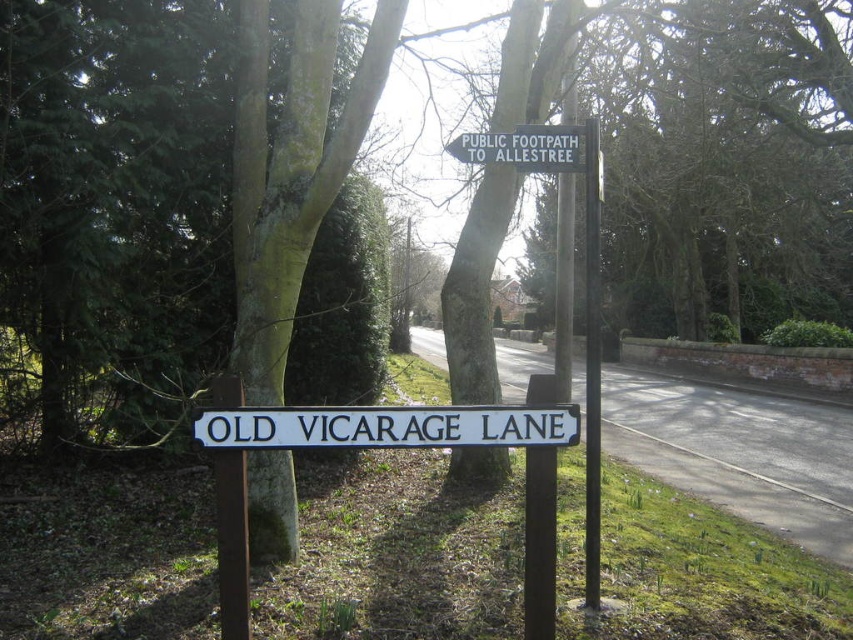
Does green rough bark tree at center come behind white wooden sign at center?

Yes, it is behind white wooden sign at center.

Can you confirm if green rough bark tree at center is thinner than white wooden sign at center?

No.

Does point (262, 163) come farther from viewer compared to point (498, 412)?

Yes, point (262, 163) is farther from viewer.

Where is `green rough bark tree at center`? green rough bark tree at center is located at coordinates (184, 211).

Is white wooden sign at center to the left of white plastic sign at upper center from the viewer's perspective?

Correct, you'll find white wooden sign at center to the left of white plastic sign at upper center.

Which is in front, point (479, 419) or point (485, 145)?

Point (479, 419)

Describe the element at coordinates (387, 426) in the screenshot. This screenshot has width=853, height=640. I see `white wooden sign at center` at that location.

Find the location of a particular element. The image size is (853, 640). white wooden sign at center is located at coordinates (387, 426).

Can you confirm if green rough bark tree at center is thinner than white plastic sign at upper center?

No.

Is point (373, 195) positioned after point (503, 136)?

Yes, point (373, 195) is farther from viewer.

Is point (165, 308) farther from viewer compared to point (503, 144)?

Yes, point (165, 308) is behind point (503, 144).

Find the location of a particular element. This screenshot has width=853, height=640. green rough bark tree at center is located at coordinates 184,211.